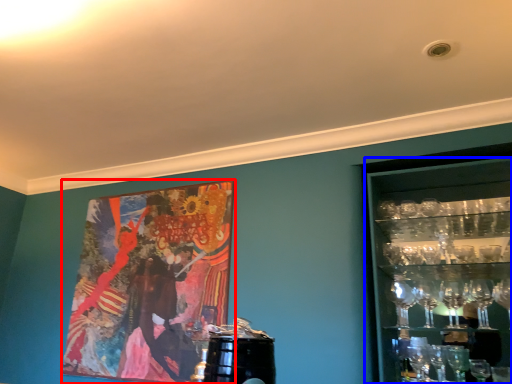
Question: Which point is further to the camera, picture frame (highlighted by a red box) or shelf (highlighted by a blue box)?

Choices:
 (A) picture frame
 (B) shelf

Answer: (A)